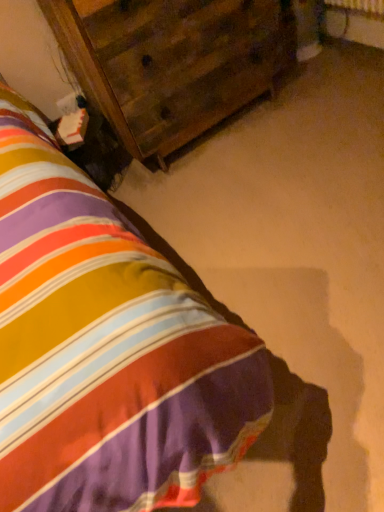
Question: Relative to wooden nightstand at center, is wooden dresser at upper left in front or behind?

Choices:
 (A) behind
 (B) front

Answer: (A)

Question: In terms of height, does wooden dresser at upper left look taller or shorter compared to wooden nightstand at center?

Choices:
 (A) tall
 (B) short

Answer: (A)

Question: Which is correct: wooden dresser at upper left is inside wooden nightstand at center, or outside of it?

Choices:
 (A) inside
 (B) outside

Answer: (B)

Question: Is point (155, 428) closer or farther from the camera than point (87, 10)?

Choices:
 (A) farther
 (B) closer

Answer: (B)

Question: In the image, is wooden nightstand at center positioned in front of or behind wooden dresser at upper left?

Choices:
 (A) behind
 (B) front

Answer: (B)

Question: Is wooden nightstand at center inside the boundaries of wooden dresser at upper left, or outside?

Choices:
 (A) outside
 (B) inside

Answer: (A)

Question: From a real-world perspective, is wooden nightstand at center positioned above or below wooden dresser at upper left?

Choices:
 (A) above
 (B) below

Answer: (B)